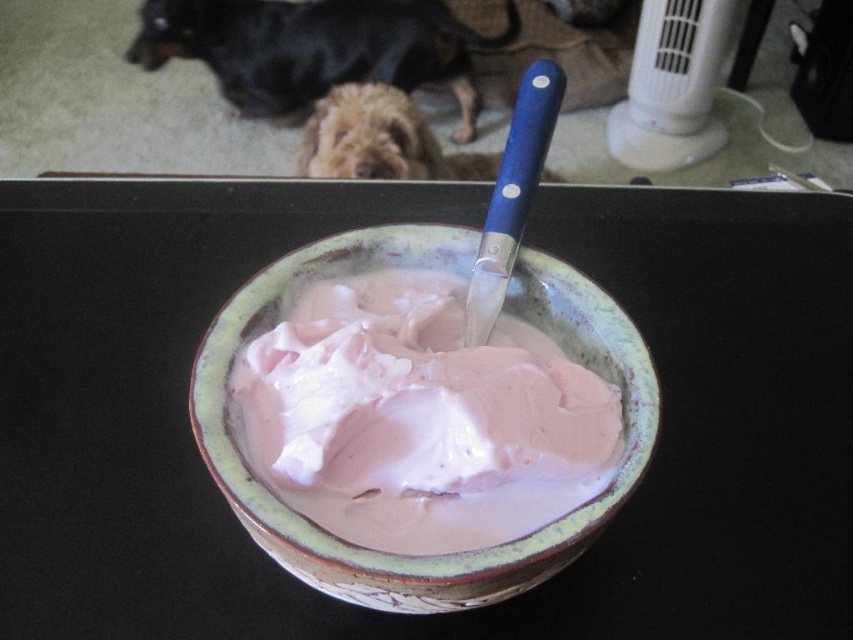
Question: Which is farther from the pink glazed bowl at center?

Choices:
 (A) black fur dog at upper left
 (B) fuzzy brown dog at center

Answer: (A)

Question: Can you confirm if pink glazed bowl at center is thinner than fuzzy brown dog at center?

Choices:
 (A) yes
 (B) no

Answer: (B)

Question: Based on their relative distances, which object is farther from the fuzzy brown dog at center?

Choices:
 (A) matte ceramic bowl at center
 (B) pink glazed bowl at center
 (C) black fur dog at upper left

Answer: (B)

Question: Which object is closer to the camera taking this photo?

Choices:
 (A) fuzzy brown dog at center
 (B) matte ceramic bowl at center
 (C) pink glazed bowl at center
 (D) black fur dog at upper left

Answer: (C)

Question: Is black fur dog at upper left to the left of fuzzy brown dog at center from the viewer's perspective?

Choices:
 (A) no
 (B) yes

Answer: (B)

Question: Where is pink glazed bowl at center located in relation to black fur dog at upper left in the image?

Choices:
 (A) below
 (B) above

Answer: (A)